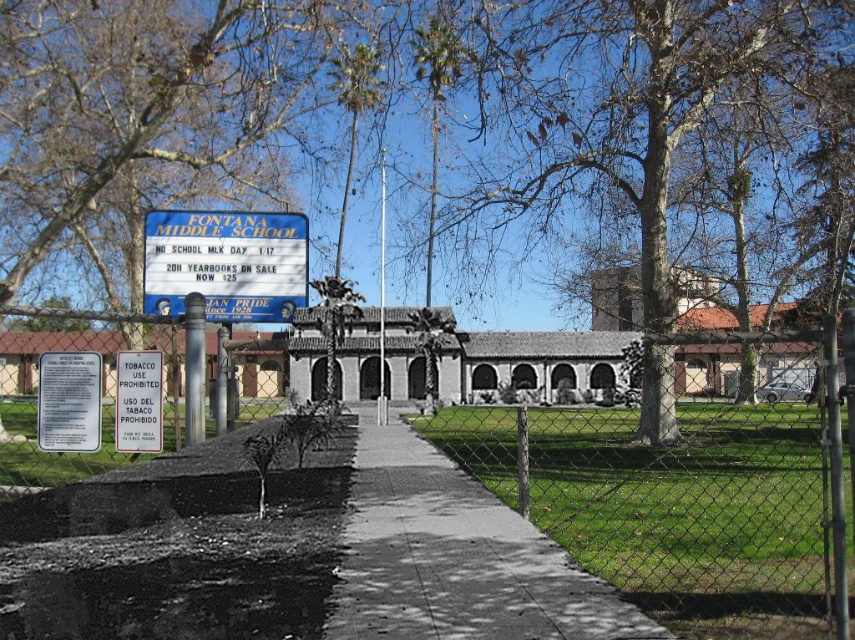
Question: Can you confirm if bare wood tree at upper center is positioned below green leafy tree at center?

Choices:
 (A) no
 (B) yes

Answer: (A)

Question: Does bare wood tree at upper center have a larger size compared to metal chain-link fence at center?

Choices:
 (A) no
 (B) yes

Answer: (B)

Question: Does bare wood tree at upper center appear over gray concrete sidewalk at center?

Choices:
 (A) yes
 (B) no

Answer: (A)

Question: Estimate the real-world distances between objects in this image. Which object is closer to the blue plastic sign at upper center?

Choices:
 (A) gray concrete sidewalk at center
 (B) metal chain-link fence at center

Answer: (A)

Question: Which point is farther to the camera?

Choices:
 (A) white paper sign at center
 (B) metal chain-link fence at center

Answer: (A)

Question: Which of the following is the closest to the observer?

Choices:
 (A) green leafy tree at center
 (B) blue plastic sign at upper center
 (C) gray concrete sidewalk at center

Answer: (C)